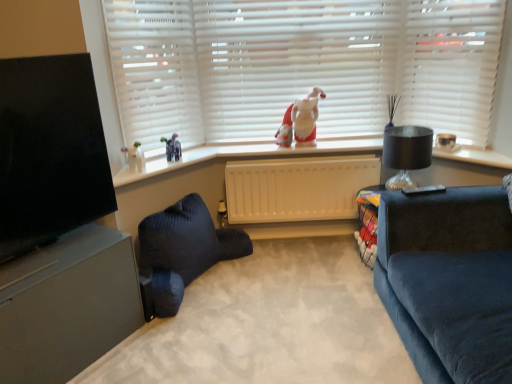
Question: From a real-world perspective, is dark blue fabric studio couch at lower center on top of white matte blinds at upper center, the first blind from the right?

Choices:
 (A) yes
 (B) no

Answer: (B)

Question: Can you confirm if dark blue fabric studio couch at lower center is wider than white matte blinds at upper center, which is counted as the second blind, starting from the left?

Choices:
 (A) yes
 (B) no

Answer: (A)

Question: Considering the relative positions of dark blue fabric studio couch at lower center and white matte blinds at upper center, which is counted as the second blind, starting from the left, in the image provided, is dark blue fabric studio couch at lower center in front of white matte blinds at upper center, which is counted as the second blind, starting from the left,?

Choices:
 (A) no
 (B) yes

Answer: (B)

Question: Considering the relative sizes of dark blue fabric studio couch at lower center and white matte blinds at upper center, which is counted as the second blind, starting from the left, in the image provided, is dark blue fabric studio couch at lower center shorter than white matte blinds at upper center, which is counted as the second blind, starting from the left,?

Choices:
 (A) no
 (B) yes

Answer: (B)

Question: Considering the relative sizes of dark blue fabric studio couch at lower center and white matte blinds at upper center, the first blind from the right, in the image provided, is dark blue fabric studio couch at lower center taller than white matte blinds at upper center, the first blind from the right,?

Choices:
 (A) yes
 (B) no

Answer: (B)

Question: From a real-world perspective, is white matte blinds at upper center, the first blind in the left-to-right sequence, physically located above or below black glossy tv at left?

Choices:
 (A) below
 (B) above

Answer: (B)

Question: Considering the positions of white matte blinds at upper center, the first blind in the left-to-right sequence, and black glossy tv at left in the image, is white matte blinds at upper center, the first blind in the left-to-right sequence, taller or shorter than black glossy tv at left?

Choices:
 (A) tall
 (B) short

Answer: (A)

Question: Is white matte blinds at upper center, the second blind in the right-to-left sequence, situated inside black glossy tv at left or outside?

Choices:
 (A) outside
 (B) inside

Answer: (A)

Question: Does point (378, 59) appear closer or farther from the camera than point (44, 130)?

Choices:
 (A) closer
 (B) farther

Answer: (B)

Question: Considering the positions of black glossy tv at left and black glass lampshade at right in the image, is black glossy tv at left wider or thinner than black glass lampshade at right?

Choices:
 (A) wide
 (B) thin

Answer: (B)

Question: Is black glossy tv at left to the left or to the right of black glass lampshade at right in the image?

Choices:
 (A) right
 (B) left

Answer: (B)

Question: Which is correct: black glossy tv at left is inside black glass lampshade at right, or outside of it?

Choices:
 (A) outside
 (B) inside

Answer: (A)

Question: From the image's perspective, is black glossy tv at left positioned above or below black glass lampshade at right?

Choices:
 (A) below
 (B) above

Answer: (A)

Question: Does point (359, 230) appear closer or farther from the camera than point (310, 215)?

Choices:
 (A) farther
 (B) closer

Answer: (B)

Question: Visually, is matte black table at right positioned to the left or to the right of beige plastic radiator at center?

Choices:
 (A) left
 (B) right

Answer: (B)